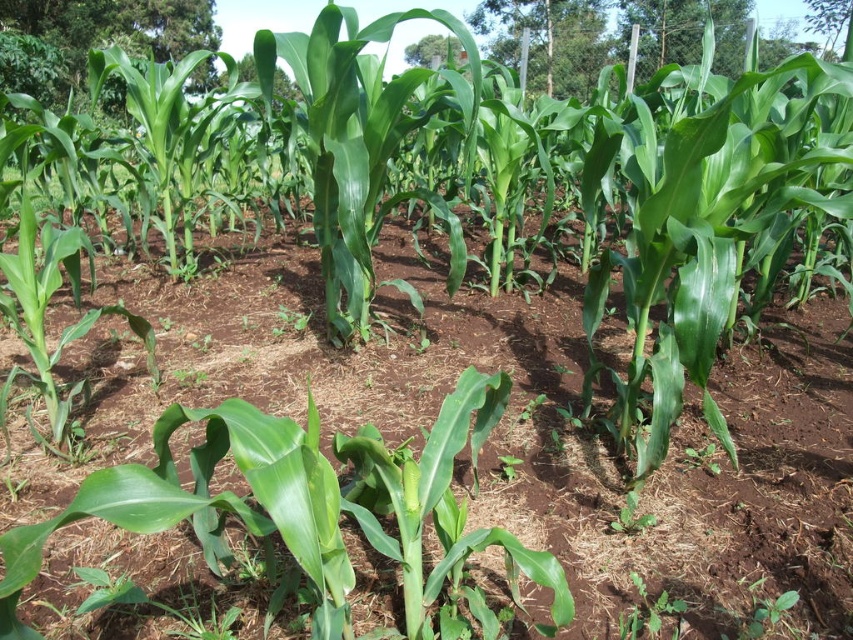
You are standing in the field and want to take a photo of the green leafy plant at center. To get a clear shot, you need to move so that the brown soil at center is no longer blocking your view. Which direction should you move?

You should move backward because the brown soil at center is closer to the viewer than the green leafy plant at center. By moving backward, you can position yourself so the brown soil at center is no longer in front of the green leafy plant at center, allowing for an unobstructed view.

You are standing in the corn field and see the point marked at coordinates (x=650, y=612). What is located at that point?

The point marked at coordinates (x=650, y=612) is where the green leafy plant at lower center is located.